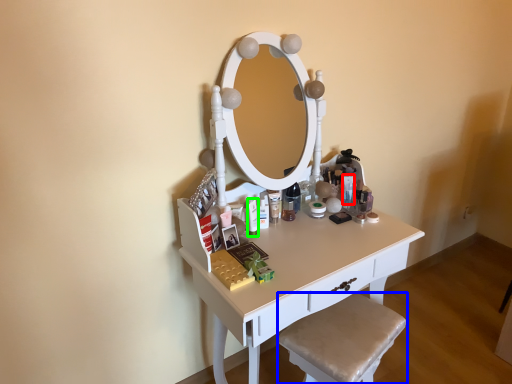
Question: Which object is the farthest from toiletry (highlighted by a red box)? Choose among these: step stool (highlighted by a blue box) or toiletry (highlighted by a green box).

Choices:
 (A) step stool
 (B) toiletry

Answer: (A)